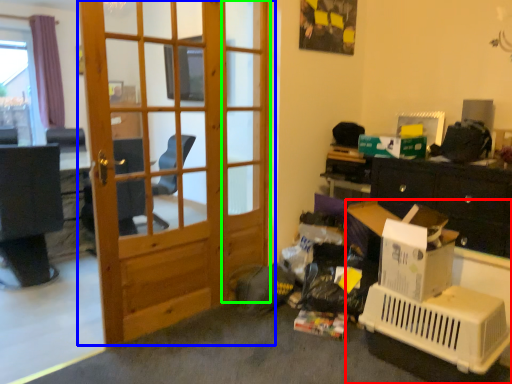
Question: Which object is the closest to the desk (highlighted by a red box)? Choose among these: door (highlighted by a blue box) or screen door (highlighted by a green box).

Choices:
 (A) door
 (B) screen door

Answer: (B)